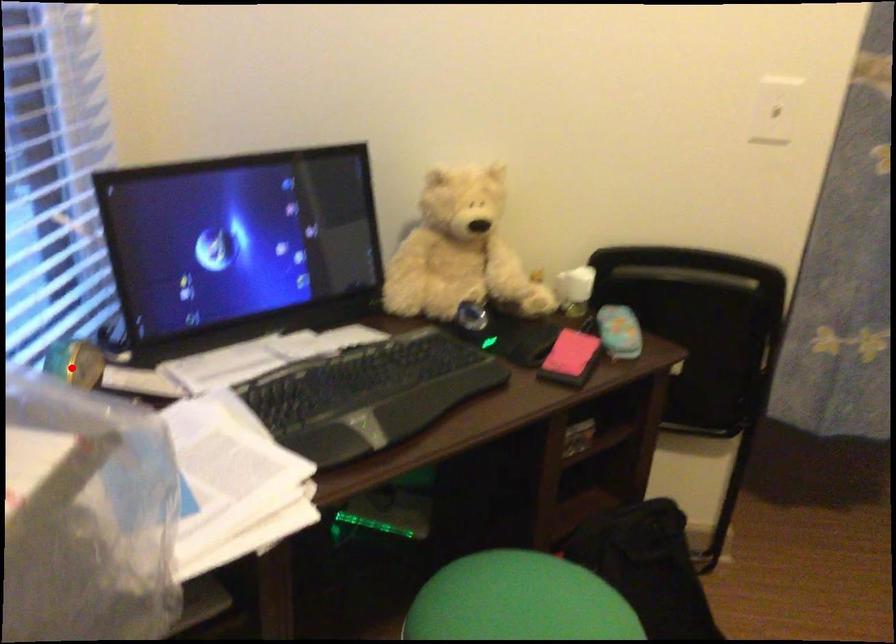
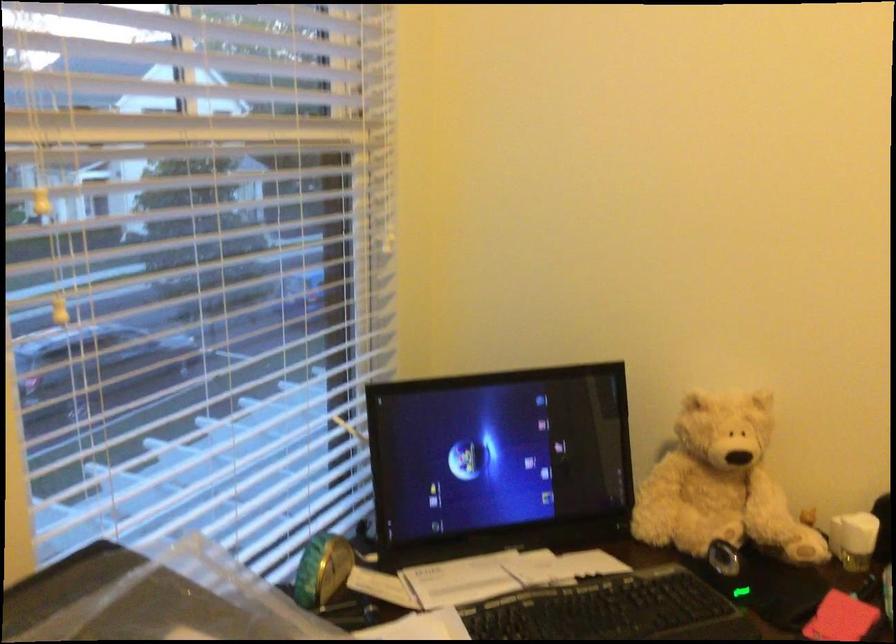
Locate, in the second image, the point that corresponds to the highlighted location in the first image.

(322, 569)